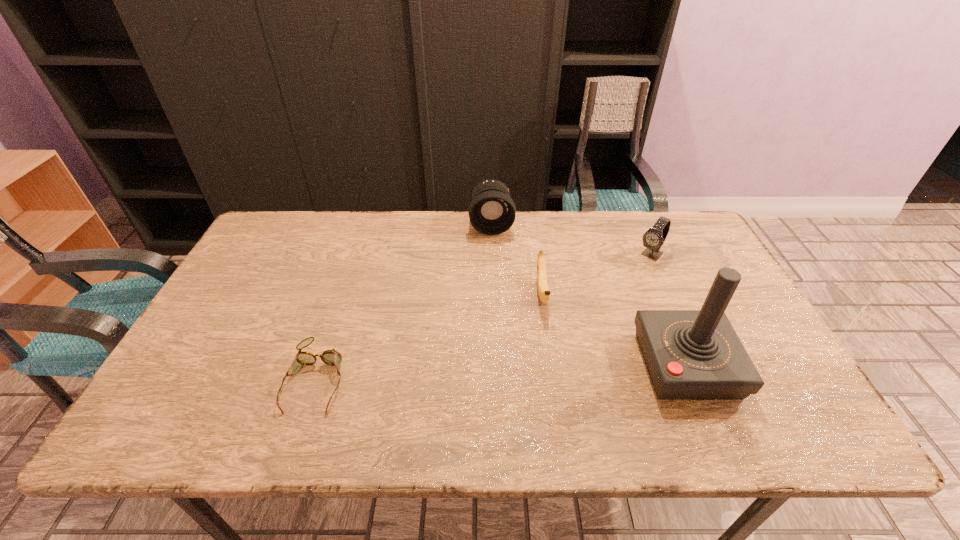
You are a GUI agent. You are given a task and a screenshot of the screen. Output one action in this format:
    pyautogui.click(x=<x>, y=<y>)
    Task: Click on the free spot between the telephoto lens and the spectacles
    The width and height of the screenshot is (960, 540).
    Given the screenshot: What is the action you would take?
    pyautogui.click(x=404, y=301)

In order to click on free space between the leftmost object and the third nearest object in this screenshot , I will do `click(429, 336)`.

Where is `the closest object relative to the telephoto lens`? Image resolution: width=960 pixels, height=540 pixels. the closest object relative to the telephoto lens is located at coordinates (544, 293).

Select which object appears as the closest to the second farthest object. Please provide its 2D coordinates. Your answer should be formatted as a tuple, i.e. [(x, y)], where the tuple contains the x and y coordinates of a point satisfying the conditions above.

[(690, 354)]

The image size is (960, 540). Find the location of `blank space that satisfies the following two spatial constraints: 1. on the front side of the joystick; 2. on the rectangular base of the second shortest object`. blank space that satisfies the following two spatial constraints: 1. on the front side of the joystick; 2. on the rectangular base of the second shortest object is located at coordinates (552, 365).

This screenshot has width=960, height=540. In order to click on vacant point that satisfies the following two spatial constraints: 1. on the front side of the third farthest object; 2. on the rectangular base of the joystick in this screenshot , I will do `click(552, 365)`.

Locate an element on the screen. This screenshot has height=540, width=960. vacant point that satisfies the following two spatial constraints: 1. on the front side of the joystick; 2. on the rectangular base of the second shortest object is located at coordinates (552, 365).